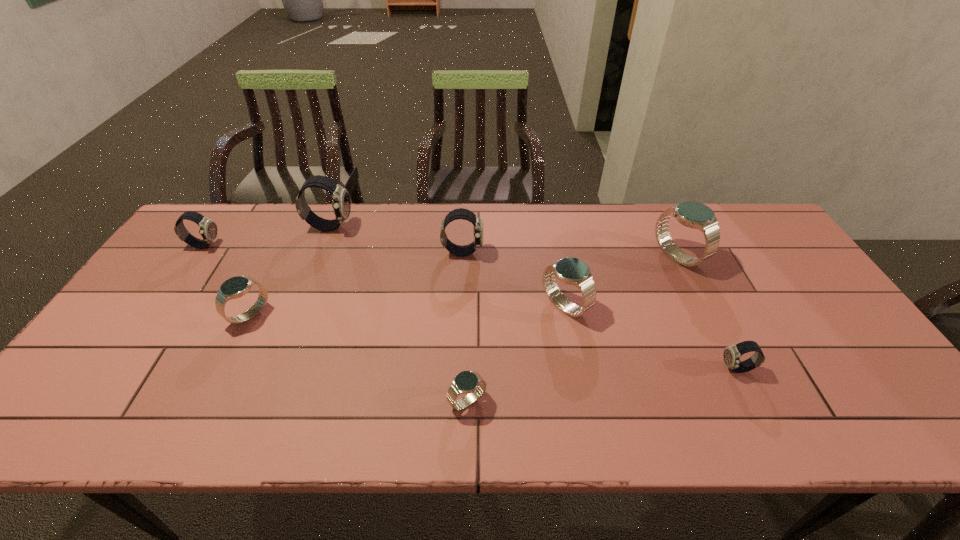
Where is `the farthest watch`? Image resolution: width=960 pixels, height=540 pixels. the farthest watch is located at coordinates (341, 205).

Locate an element on the screen. This screenshot has width=960, height=540. the second dark watch from left to right is located at coordinates (341, 205).

Where is `the biggest blue watch`? the biggest blue watch is located at coordinates point(691,214).

At what (x,y) coordinates should I click in order to perform the action: click on the rightmost blue watch. Please return your answer as a coordinate pair (x, y). The height and width of the screenshot is (540, 960). Looking at the image, I should click on coord(691,214).

Locate an element on the screen. This screenshot has height=540, width=960. the second biggest dark watch is located at coordinates (461, 213).

Locate an element on the screen. Image resolution: width=960 pixels, height=540 pixels. the sixth object from left to right is located at coordinates (572, 271).

Image resolution: width=960 pixels, height=540 pixels. I want to click on the second biggest blue watch, so click(x=572, y=271).

The height and width of the screenshot is (540, 960). I want to click on the leftmost dark watch, so click(208, 229).

Locate an element on the screen. The image size is (960, 540). the leftmost watch is located at coordinates 208,229.

What are the coordinates of `the second smallest blue watch` in the screenshot? It's located at (235, 287).